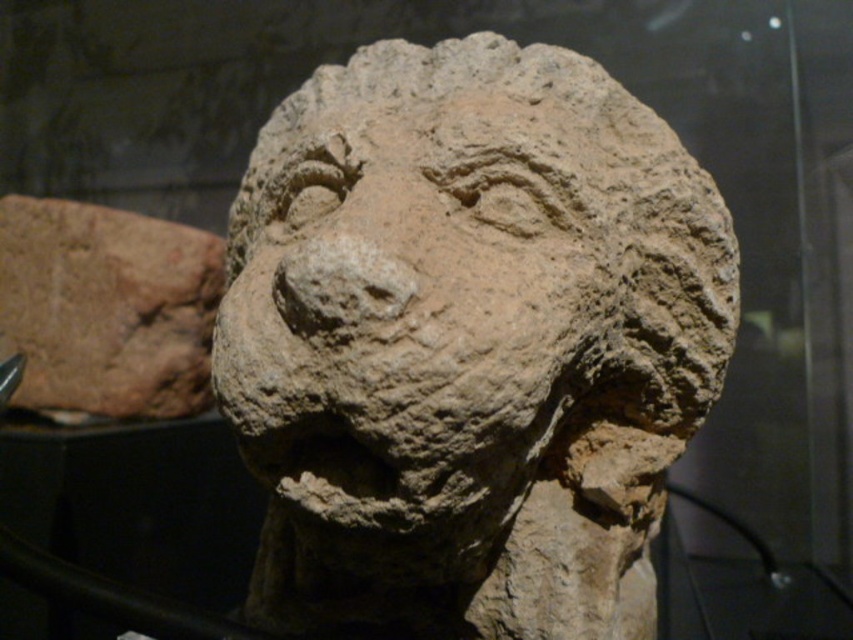
You are an archaeologist examining the ancient stone sculpture. You notice two objects in the scene. One is the earthen stone lion at center and the other is the brown clay head at left. Based on their sizes, which object would you estimate to be closer to the front of the sculpture?

The earthen stone lion at center is taller than the brown clay head at left, so it is likely positioned closer to the front of the sculpture since larger objects typically appear closer in such contexts.

You are an archaeologist examining the ancient stone sculpture. You notice two objects in the scene. The first is the earthen stone lion at center, and the second is the brown clay head at left. Based on their positions, which object is positioned lower in the image?

The earthen stone lion at center is located below the brown clay head at left, so it is positioned lower in the image.